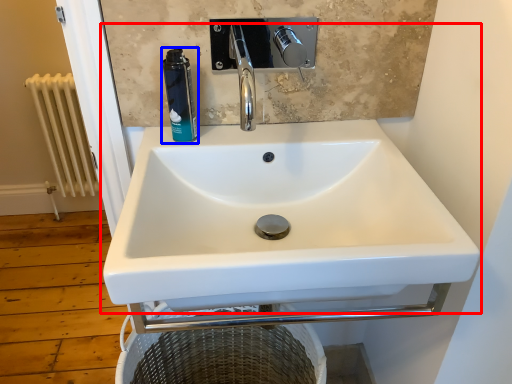
Question: Which of the following is the closest to the observer, sink (highlighted by a red box) or mouthwash (highlighted by a blue box)?

Choices:
 (A) sink
 (B) mouthwash

Answer: (A)